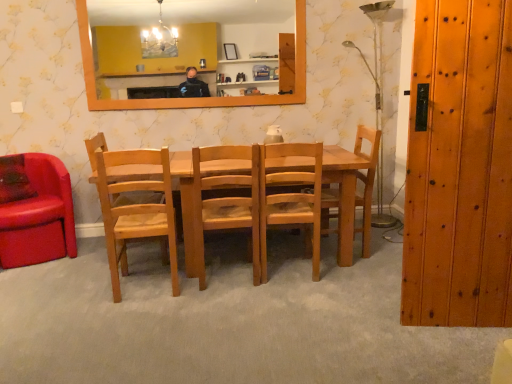
Identify the location of vacant space underneath natural wood chair at left, the 2th chair from the left (from a real-world perspective). This screenshot has width=512, height=384. (149, 286).